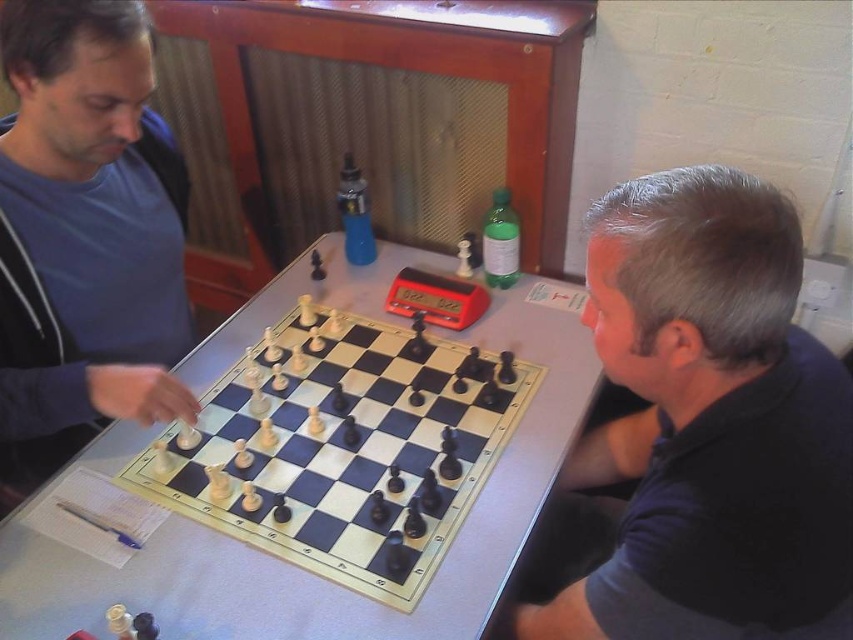
Which of these two, dark blue shirt at right or matte blue shirt at upper left, stands shorter?

Standing shorter between the two is dark blue shirt at right.

Who is higher up, dark blue shirt at right or matte blue shirt at upper left?

matte blue shirt at upper left is above.

Does point (605, 346) come farther from viewer compared to point (67, 308)?

That is False.

You are a GUI agent. You are given a task and a screenshot of the screen. Output one action in this format:
    pyautogui.click(x=<x>, y=<y>)
    Task: Click on the dark blue shirt at right
    This screenshot has height=640, width=853.
    Given the screenshot: What is the action you would take?
    pyautogui.click(x=711, y=422)

Can you confirm if dark blue shirt at right is wider than white plastic chessboard at center?

No, dark blue shirt at right is not wider than white plastic chessboard at center.

Which is more to the right, dark blue shirt at right or white plastic chessboard at center?

Positioned to the right is dark blue shirt at right.

Who is more distant from viewer, (618,611) or (331,618)?

Positioned behind is point (331,618).

Find the location of a particular element. The height and width of the screenshot is (640, 853). dark blue shirt at right is located at coordinates (711, 422).

Is matte blue shirt at upper left in front of white plastic chessboard at center?

No, it is behind white plastic chessboard at center.

Is matte blue shirt at upper left below white plastic chessboard at center?

Incorrect, matte blue shirt at upper left is not positioned below white plastic chessboard at center.

Between point (86, 394) and point (171, 548), which one is positioned behind?

The point (86, 394) is behind.

At what (x,y) coordinates should I click in order to perform the action: click on matte blue shirt at upper left. Please return your answer as a coordinate pair (x, y). Image resolution: width=853 pixels, height=640 pixels. Looking at the image, I should click on (85, 232).